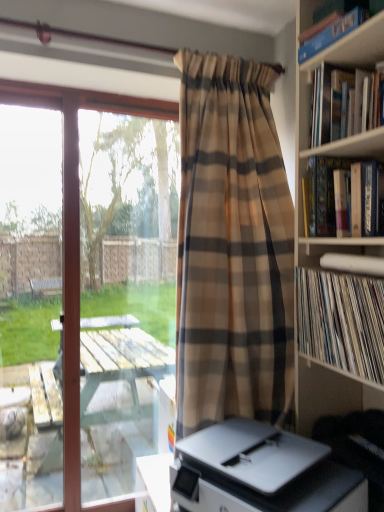
Question: Can you confirm if transparent glass window at left is wider than blue hardcover book at upper right, which is counted as the fourth book, starting from the bottom?

Choices:
 (A) yes
 (B) no

Answer: (B)

Question: From a real-world perspective, is transparent glass window at left on top of blue hardcover book at upper right, the 1th book positioned from the top?

Choices:
 (A) yes
 (B) no

Answer: (B)

Question: Considering the relative sizes of transparent glass window at left and blue hardcover book at upper right, the 1th book positioned from the top, in the image provided, is transparent glass window at left taller than blue hardcover book at upper right, the 1th book positioned from the top,?

Choices:
 (A) no
 (B) yes

Answer: (B)

Question: Is transparent glass window at left facing away from blue hardcover book at upper right, the 1th book positioned from the top?

Choices:
 (A) no
 (B) yes

Answer: (A)

Question: Is transparent glass window at left at the left side of blue hardcover book at upper right, which is counted as the fourth book, starting from the bottom?

Choices:
 (A) yes
 (B) no

Answer: (A)

Question: Can you confirm if transparent glass window at left is thinner than blue hardcover book at upper right, the 1th book positioned from the top?

Choices:
 (A) no
 (B) yes

Answer: (B)

Question: Is blue hardcover book at upper right, the 1th book positioned from the top, positioned with its back to hardcover book at upper right, marked as the second book in a bottom-to-top arrangement?

Choices:
 (A) no
 (B) yes

Answer: (A)

Question: Is blue hardcover book at upper right, which is counted as the fourth book, starting from the bottom, positioned far away from hardcover book at upper right, which ranks as the third book in top-to-bottom order?

Choices:
 (A) no
 (B) yes

Answer: (A)

Question: From the image's perspective, is blue hardcover book at upper right, which is counted as the fourth book, starting from the bottom, over hardcover book at upper right, which ranks as the third book in top-to-bottom order?

Choices:
 (A) yes
 (B) no

Answer: (A)

Question: Considering the relative positions of blue hardcover book at upper right, which is counted as the fourth book, starting from the bottom, and hardcover book at upper right, marked as the second book in a bottom-to-top arrangement, in the image provided, is blue hardcover book at upper right, which is counted as the fourth book, starting from the bottom, to the left of hardcover book at upper right, marked as the second book in a bottom-to-top arrangement, from the viewer's perspective?

Choices:
 (A) no
 (B) yes

Answer: (B)

Question: From a real-world perspective, is blue hardcover book at upper right, the 1th book positioned from the top, located higher than hardcover book at upper right, which ranks as the third book in top-to-bottom order?

Choices:
 (A) yes
 (B) no

Answer: (A)

Question: Is blue hardcover book at upper right, which is counted as the fourth book, starting from the bottom, next to hardcover book at upper right, marked as the second book in a bottom-to-top arrangement, and touching it?

Choices:
 (A) no
 (B) yes

Answer: (A)

Question: Is transparent glass window at left turned away from white vinyl records at right, marked as the 4th book in a top-to-bottom arrangement?

Choices:
 (A) yes
 (B) no

Answer: (B)